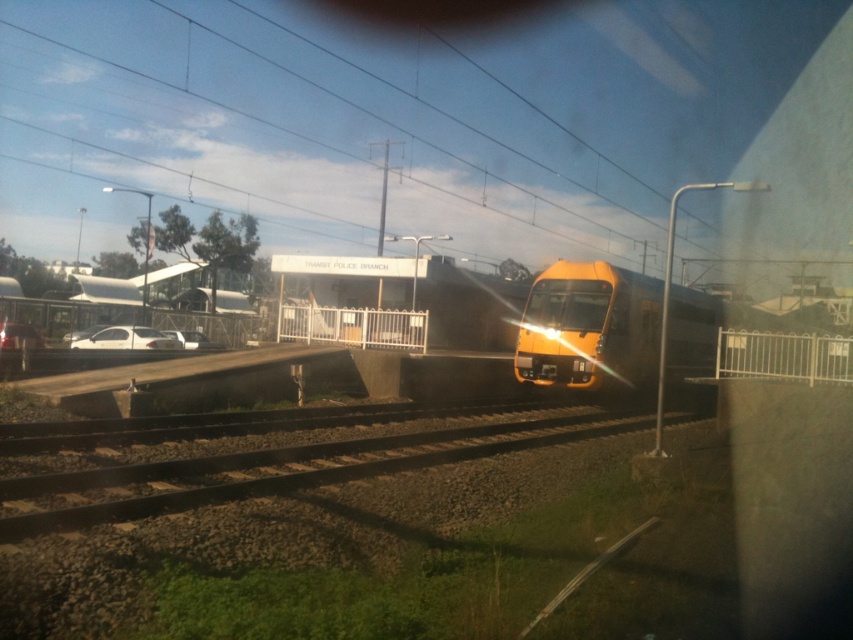
Is metal tracks at center closer to camera compared to white matte car at lower left?

Yes, it is.

Does point (351, 440) come farther from viewer compared to point (204, 342)?

No, it is not.

Where is `metal tracks at center`? metal tracks at center is located at coordinates (268, 472).

Can you confirm if white matte car at left is positioned to the left of white matte car at lower left?

Indeed, white matte car at left is positioned on the left side of white matte car at lower left.

Between white matte car at left and white matte car at lower left, which one is positioned lower?

white matte car at lower left

Where is `white matte car at left`? Image resolution: width=853 pixels, height=640 pixels. white matte car at left is located at coordinates (126, 339).

At what (x,y) coordinates should I click in order to perform the action: click on white matte car at left. Please return your answer as a coordinate pair (x, y). The image size is (853, 640). Looking at the image, I should click on (126, 339).

Between point (589, 372) and point (178, 337), which one is positioned in front?

Point (589, 372)

In the scene shown: Can you confirm if yellow metallic train at center is thinner than white matte car at lower left?

In fact, yellow metallic train at center might be wider than white matte car at lower left.

Where is `yellow metallic train at center`? The image size is (853, 640). yellow metallic train at center is located at coordinates (590, 326).

Locate an element on the screen. Image resolution: width=853 pixels, height=640 pixels. yellow metallic train at center is located at coordinates click(590, 326).